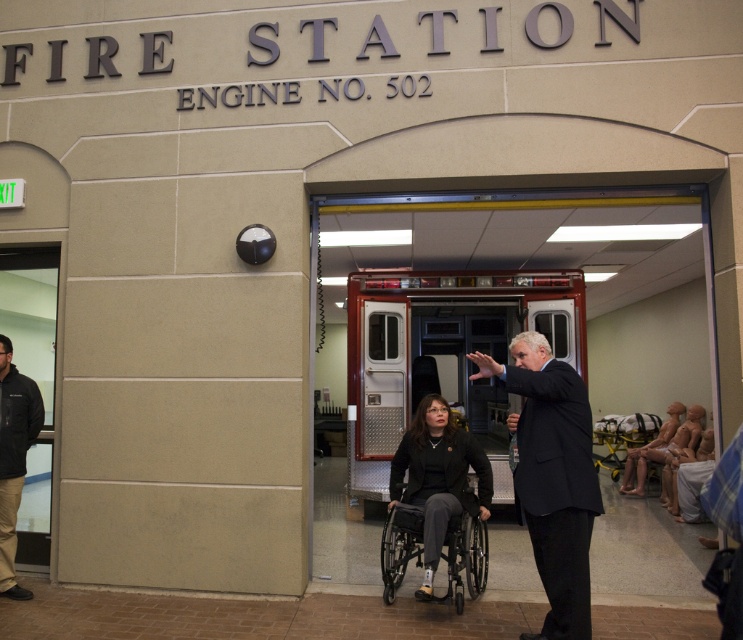
You are a firefighter trying to locate the metallic silver fire truck at center in the fire station. Based on the coordinates provided, where would you find it?

The metallic silver fire truck at center is located at coordinates point (444, 355).

You are a firefighter arriving at the fire station entrance. You see the metallic silver fire truck at center and the black jacket at left. Which object is closer to the entrance doorway?

The black jacket at left is closer to the entrance doorway because the metallic silver fire truck at center is to the right of it.

You are a firefighter entering the fire station and see the black jacket at left and the smooth beige mannequin at right. Which object is higher up in the room?

The black jacket at left is above the smooth beige mannequin at right.